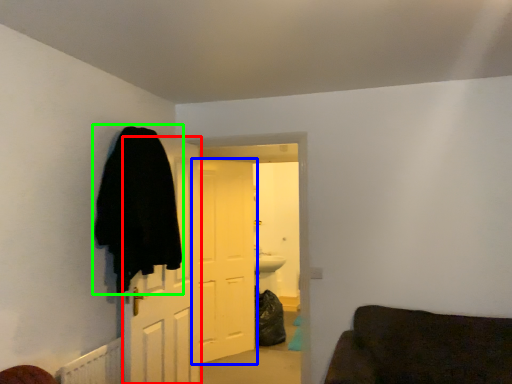
Question: Which object is the closest to the door (highlighted by a red box)? Choose among these: door (highlighted by a blue box) or cloak (highlighted by a green box).

Choices:
 (A) door
 (B) cloak

Answer: (B)